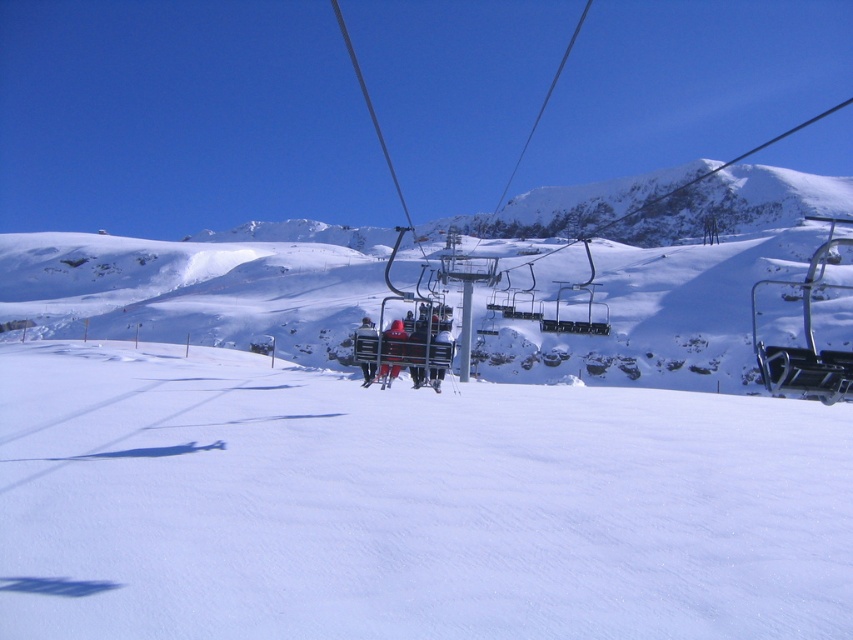
Which is behind, point (387, 364) or point (428, 376)?

Point (428, 376)

Can you confirm if red fabric jacket at center is shorter than matte black ski suit at center?

No.

Based on the photo, measure the distance between red fabric jacket at center and camera.

23.11 meters

Where is `red fabric jacket at center`? This screenshot has width=853, height=640. red fabric jacket at center is located at coordinates (392, 353).

Does matte black ski suit at center appear under black fabric jacket at center?

No.

Does matte black ski suit at center have a larger size compared to black fabric jacket at center?

Incorrect, matte black ski suit at center is not larger than black fabric jacket at center.

What do you see at coordinates (439, 356) in the screenshot? I see `matte black ski suit at center` at bounding box center [439, 356].

Locate an element on the screen. This screenshot has width=853, height=640. matte black ski suit at center is located at coordinates (439, 356).

Measure the distance between point (117, 480) and camera.

Point (117, 480) and camera are 54.49 feet apart from each other.

Is point (468, 628) positioned in front of point (413, 387)?

Yes, point (468, 628) is closer to viewer.

Locate an element on the screen. Image resolution: width=853 pixels, height=640 pixels. white powdery snow at center is located at coordinates (405, 504).